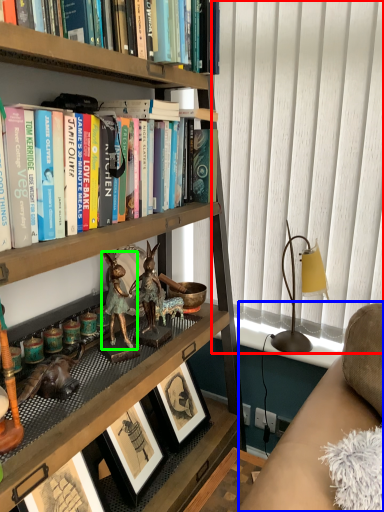
Question: Considering the real-world distances, which object is closest to curtain (highlighted by a red box)? studio couch (highlighted by a blue box) or animal (highlighted by a green box).

Choices:
 (A) studio couch
 (B) animal

Answer: (A)